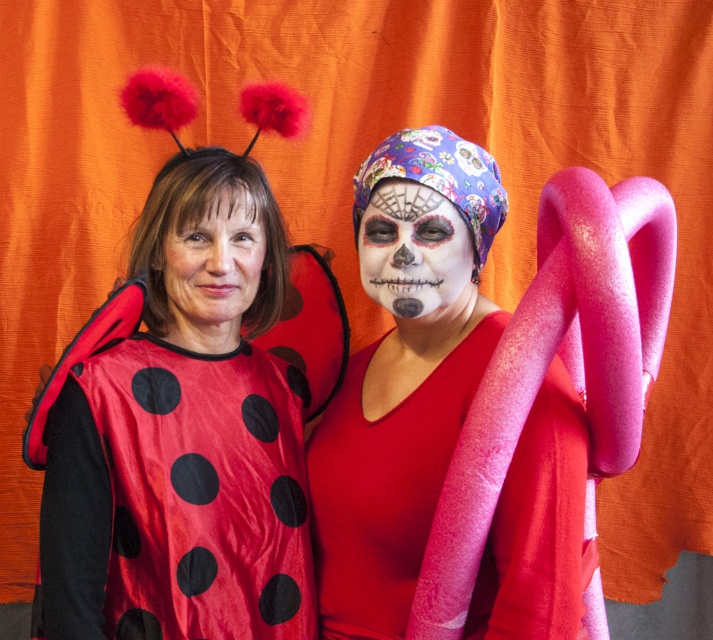
Question: Is matte fabric ladybug costume at left bigger than white painted skull at center?

Choices:
 (A) yes
 (B) no

Answer: (A)

Question: Among these objects, which one is farthest from the camera?

Choices:
 (A) matte fabric ladybug costume at left
 (B) white painted skull at center

Answer: (B)

Question: Among these objects, which one is farthest from the camera?

Choices:
 (A) smooth matte skin at center
 (B) matte pink foam antennae at center
 (C) white painted skull at center

Answer: (A)

Question: From the image, what is the correct spatial relationship of matte fabric ladybug costume at left in relation to matte pink foam antennae at center?

Choices:
 (A) right
 (B) left

Answer: (B)

Question: Among these points, which one is farthest from the camera?

Choices:
 (A) (421, 230)
 (B) (399, 304)
 (C) (93, 502)
 (D) (207, 227)

Answer: (D)

Question: Does matte fabric ladybug costume at left have a larger size compared to matte pink foam antennae at center?

Choices:
 (A) no
 (B) yes

Answer: (A)